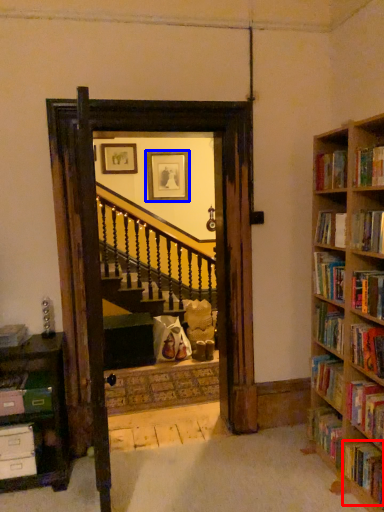
Question: Which point is closer to the camera, book (highlighted by a red box) or picture frame (highlighted by a blue box)?

Choices:
 (A) book
 (B) picture frame

Answer: (A)